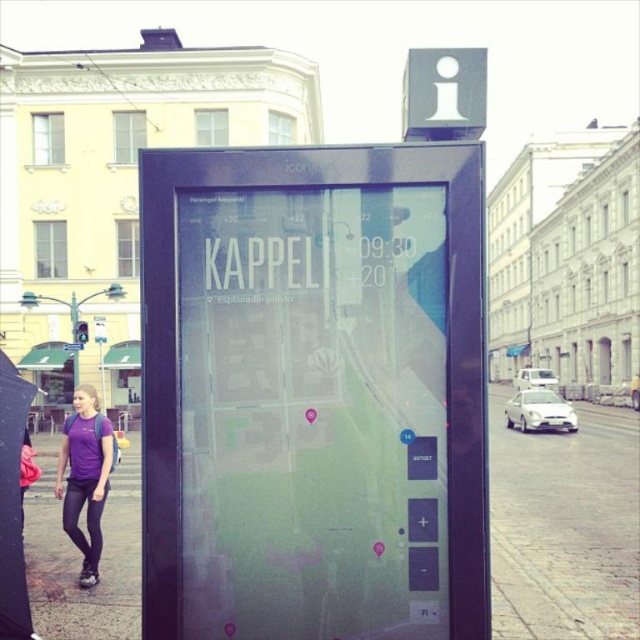
You are standing in front of the digital information kiosk and want to find the matte glass pavement at lower left. According to the map displayed on the kiosk, where should you look to locate it?

The matte glass pavement at lower left is located at point (564, 528) on the map displayed on the kiosk.

You are standing in front of the transparent glass information kiosk at center and want to see the purple fabric shirt at lower left. Can you see the entire shirt without moving your head?

The transparent glass information kiosk at center is wider than the purple fabric shirt at lower left, so it might block your view of the entire shirt unless you move your head or position yourself appropriately.

You are a tourist holding a map that is 1 meter wide. You want to place it on the transparent glass information kiosk at center or the brick pavement at lower right. Which surface can accommodate your map?

The brick pavement at lower right is larger than the transparent glass information kiosk at center, so the map can be placed on the brick pavement at lower right.